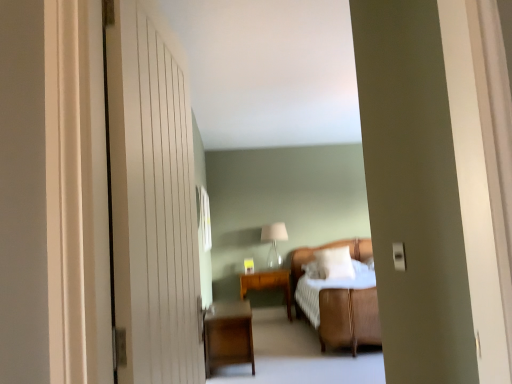
From the picture: Measure the distance between translucent glass table lamp at center and camera.

The depth of translucent glass table lamp at center is 6.37 meters.

What is the approximate width of clear glass window at center?

It is 1.43 inches.

The width and height of the screenshot is (512, 384). I want to click on wooden side table at center, so click(x=268, y=284).

The image size is (512, 384). Describe the element at coordinates (228, 335) in the screenshot. I see `dark wood nightstand at lower left` at that location.

Measure the distance between point (337, 242) and camera.

They are 6.75 meters apart.

Where is `white wooden door at left`? The height and width of the screenshot is (384, 512). white wooden door at left is located at coordinates (152, 201).

From the image's perspective, would you say white textured bed at center is shown under translucent glass table lamp at center?

Indeed, from the image's perspective, white textured bed at center is shown beneath translucent glass table lamp at center.

Considering the positions of objects white textured bed at center and translucent glass table lamp at center in the image provided, who is behind, white textured bed at center or translucent glass table lamp at center?

translucent glass table lamp at center is further from the camera.

The width and height of the screenshot is (512, 384). Find the location of `bed below the translucent glass table lamp at center (from the image's perspective)`. bed below the translucent glass table lamp at center (from the image's perspective) is located at coordinates (349, 318).

Who is bigger, dark wood nightstand at lower left or white textured bed at center?

white textured bed at center.

Does dark wood nightstand at lower left have a lesser width compared to white textured bed at center?

Yes, dark wood nightstand at lower left is thinner than white textured bed at center.

Consider the image. Is dark wood nightstand at lower left positioned with its back to white textured bed at center?

No, dark wood nightstand at lower left's orientation is not away from white textured bed at center.

Is wooden side table at center situated inside clear glass window at center or outside?

wooden side table at center exists outside the volume of clear glass window at center.

Is wooden side table at center smaller than clear glass window at center?

Actually, wooden side table at center might be larger than clear glass window at center.

How many degrees apart are the facing directions of wooden side table at center and clear glass window at center?

There is a 92.5-degree angle between the facing directions of wooden side table at center and clear glass window at center.

Is wooden side table at center aimed at clear glass window at center?

No.

Who is more distant, dark wood nightstand at lower left or clear glass window at center?

clear glass window at center is more distant.

Is dark wood nightstand at lower left directly adjacent to clear glass window at center?

There is a gap between dark wood nightstand at lower left and clear glass window at center.

How different are the orientations of dark wood nightstand at lower left and clear glass window at center in degrees?

0.396 degrees separate the facing orientations of dark wood nightstand at lower left and clear glass window at center.

From the image's perspective, between dark wood nightstand at lower left and clear glass window at center, which one is located above?

From the image's view, clear glass window at center is above.

From the image's perspective, would you say wooden side table at center is shown under white wooden door at left?

Yes.

Find the location of `table located on the right of white wooden door at left`. table located on the right of white wooden door at left is located at coordinates (268, 284).

Considering the relative positions of wooden side table at center and white wooden door at left in the image provided, is wooden side table at center to the left of white wooden door at left from the viewer's perspective?

No.

Is point (242, 295) less distant than point (174, 327)?

No, (242, 295) is further to viewer.

Are white wooden door at left and wooden side table at center beside each other?

They are not placed beside each other.

From a real-world perspective, which object stands above the other?

white wooden door at left, from a real-world perspective.

You are a GUI agent. You are given a task and a screenshot of the screen. Output one action in this format:
    pyautogui.click(x=<x>, y=<y>)
    Task: Click on the table on the right of white wooden door at left
    The height and width of the screenshot is (384, 512).
    Given the screenshot: What is the action you would take?
    pyautogui.click(x=268, y=284)

Does point (201, 212) lie in front of point (269, 227)?

Yes, point (201, 212) is in front of point (269, 227).

From a real-world perspective, relative to translucent glass table lamp at center, is clear glass window at center vertically above or below?

→ clear glass window at center is situated higher than translucent glass table lamp at center in the real world.

Which is in front, clear glass window at center or translucent glass table lamp at center?

clear glass window at center.

The width and height of the screenshot is (512, 384). Identify the location of table lamp above the white textured bed at center (from the image's perspective). (274, 242).

Where is `nightstand that is below the white textured bed at center (from the image's perspective)`? The width and height of the screenshot is (512, 384). nightstand that is below the white textured bed at center (from the image's perspective) is located at coordinates (228, 335).

Looking at the image, which one is located further to white textured bed at center, white wooden door at left or dark wood nightstand at lower left?

Based on the image, white wooden door at left appears to be further to white textured bed at center.

Considering their positions, is translucent glass table lamp at center positioned closer to white soft pillow at center than white textured bed at center?

Based on the image, white textured bed at center appears to be nearer to white soft pillow at center.

Considering their positions, is dark wood nightstand at lower left positioned closer to wooden side table at center than white textured bed at center?

The object closer to wooden side table at center is white textured bed at center.

When comparing their distances from dark wood nightstand at lower left, does white wooden door at left or translucent glass table lamp at center seem closer?

Based on the image, white wooden door at left appears to be nearer to dark wood nightstand at lower left.

When comparing their distances from white soft pillow at center, does white textured bed at center or clear glass window at center seem further?

clear glass window at center is positioned further to the anchor white soft pillow at center.

Considering their positions, is white textured bed at center positioned further to white soft pillow at center than wooden side table at center?

white textured bed at center.

Looking at the image, which one is located closer to clear glass window at center, dark wood nightstand at lower left or white soft pillow at center?

dark wood nightstand at lower left lies closer to clear glass window at center than the other object.

Based on their spatial positions, is translucent glass table lamp at center or dark wood nightstand at lower left closer to white soft pillow at center?

Among the two, translucent glass table lamp at center is located nearer to white soft pillow at center.

Locate an element on the screen. table between white wooden door at left and translucent glass table lamp at center in the front-back direction is located at coordinates (268, 284).

Locate an element on the screen. The image size is (512, 384). nightstand between white wooden door at left and white textured bed at center from front to back is located at coordinates (228, 335).

Locate an element on the screen. The image size is (512, 384). window between white textured bed at center and translucent glass table lamp at center along the z-axis is located at coordinates (204, 217).

Where is `nightstand between white wooden door at left and translucent glass table lamp at center from front to back`? The height and width of the screenshot is (384, 512). nightstand between white wooden door at left and translucent glass table lamp at center from front to back is located at coordinates (228, 335).